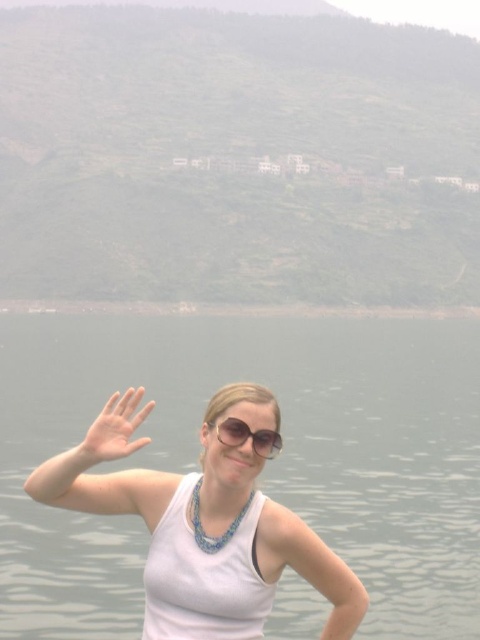
Who is lower down, smooth flesh hand at lower left or sunglasses at center?

smooth flesh hand at lower left is below.

Between smooth flesh hand at lower left and sunglasses at center, which one is positioned higher?

sunglasses at center

I want to click on smooth flesh hand at lower left, so click(x=116, y=428).

Where is `pale skin flesh at left`? This screenshot has width=480, height=640. pale skin flesh at left is located at coordinates (105, 474).

Which of these two, pale skin flesh at left or smooth flesh hand at lower left, stands taller?

Standing taller between the two is pale skin flesh at left.

Which is in front, point (72, 476) or point (120, 449)?

Point (120, 449) is more forward.

This screenshot has width=480, height=640. In order to click on pale skin flesh at left in this screenshot , I will do 105,474.

Between point (154, 497) and point (79, 499), which one is positioned behind?

Positioned behind is point (154, 497).

Does white fabric at center have a lesser width compared to pale skin flesh at left?

No, white fabric at center is not thinner than pale skin flesh at left.

Find the location of `white fabric at center`. white fabric at center is located at coordinates (203, 524).